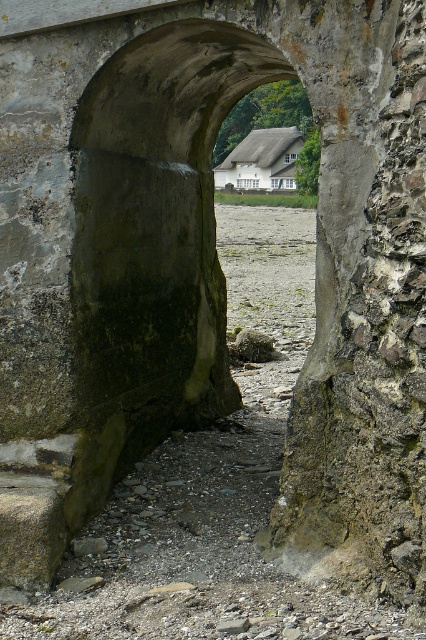
You are standing in front of the stone archway and want to reach the point at coordinates (103, 195). Given that the archway is partially collapsed on the right side, can you safely walk through the archway to reach that point?

The point at coordinates (103, 195) is 14.69 feet away from you. Since the archway is partially collapsed on the right side, you can still walk through the remaining intact part of the archway to reach the point safely.

You are standing in front of the stone archway and want to take a photo of the dark gray stone archway at center. Where should you position yourself to capture it in the center of your camera frame?

Position yourself directly in front of the dark gray stone archway at center, aligned with its central point at coordinates approximately 0.348 on the x and 0.369 on the y axis to center it in your camera frame.